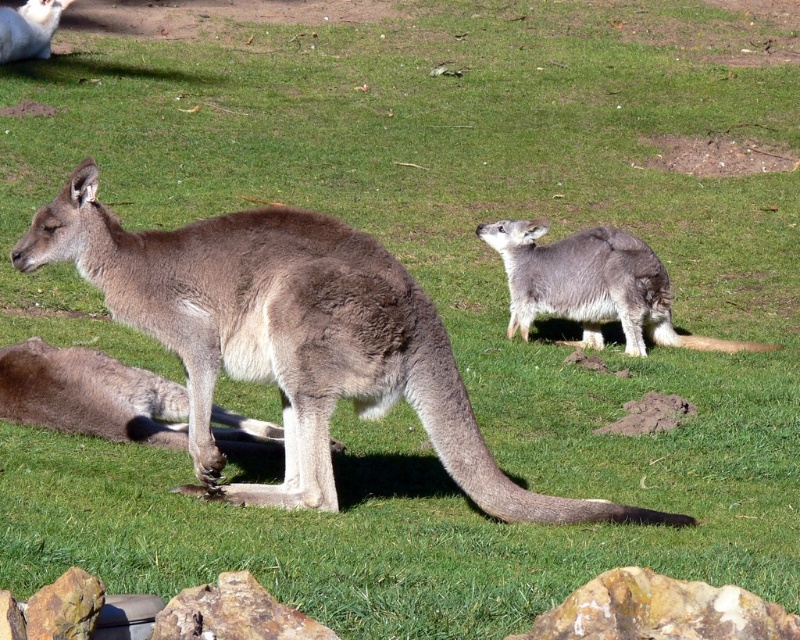
You are a hiker trying to identify two rocks in the scene. You see the rusty rock at lower center and the brown rough rock at lower center. Which rock is located to the right of the other?

The rusty rock at lower center is positioned on the right side of brown rough rock at lower center.

You are a hiker who wants to place a small flag between the rusty rock at lower center and the brown rough rock at lower center. According to the scene, where should you place the flag so it is between them?

The rusty rock at lower center is located above the brown rough rock at lower center, so you should place the flag below the rusty rock at lower center and above the brown rough rock at lower center to be between them.

You are a photographer trying to capture both the gray fur kangaroo at center and the rusty rock at lower left in a single frame. Based on their sizes, which object should you focus on first to ensure they both fit in the photo?

The gray fur kangaroo at center might be wider than rusty rock at lower left, so you should focus on the gray fur kangaroo at center first to ensure both fit in the photo.